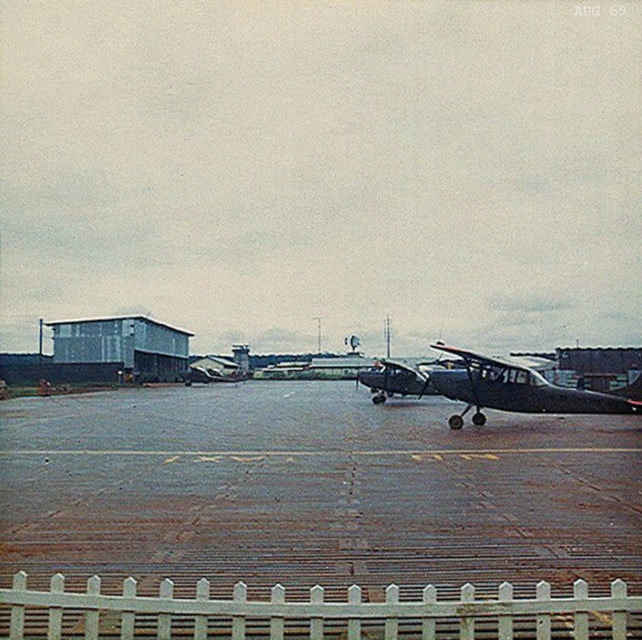
Question: Estimate the real-world distances between objects in this image. Which object is farther from the metallic gray hangar at left?

Choices:
 (A) dark gray asphalt runway at center
 (B) metallic gray airplane at center

Answer: (A)

Question: Based on their relative distances, which object is nearer to the dark gray asphalt runway at center?

Choices:
 (A) metallic gray airplane at center
 (B) metallic gray hangar at left

Answer: (A)

Question: Observing the image, what is the correct spatial positioning of dark gray asphalt runway at center in reference to metallic gray hangar at left?

Choices:
 (A) left
 (B) right

Answer: (B)

Question: Does metallic gray airplane at center appear under metallic gray hangar at left?

Choices:
 (A) yes
 (B) no

Answer: (A)

Question: Can you confirm if dark gray asphalt runway at center is wider than metallic gray airplane at center?

Choices:
 (A) yes
 (B) no

Answer: (A)

Question: Which point is farther to the camera?

Choices:
 (A) dark gray asphalt runway at center
 (B) metallic gray airplane at center

Answer: (B)